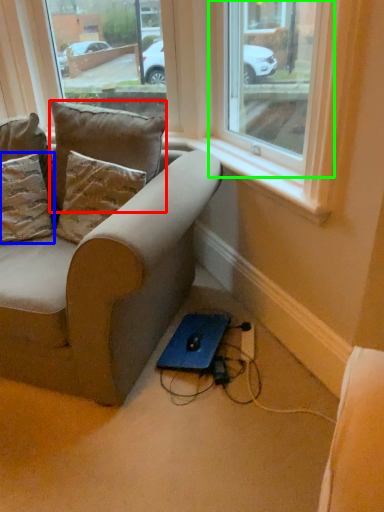
Question: Which is farther away from pillow (highlighted by a red box)? pillow (highlighted by a blue box) or window (highlighted by a green box)?

Choices:
 (A) pillow
 (B) window

Answer: (B)